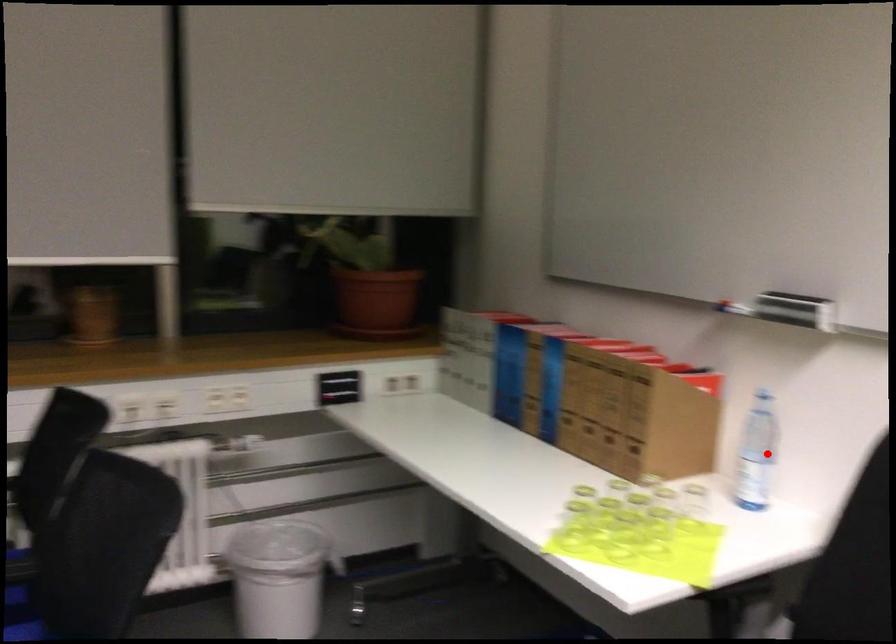
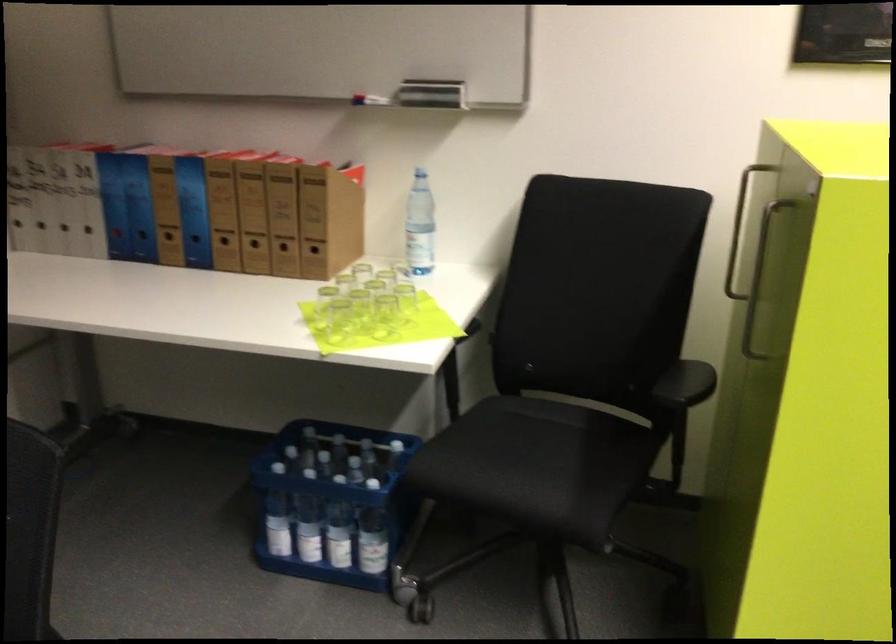
Question: I am providing you with two images of the same scene from different viewpoints. A red point is marked on the first image. Is the red point's position out of view in image 2?

Choices:
 (A) Yes
 (B) No

Answer: (B)